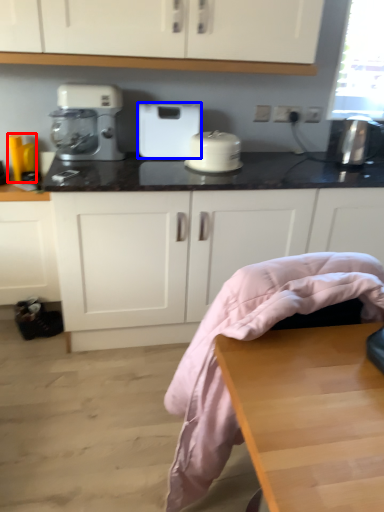
Question: Which object appears closest to the camera in this image, appliance (highlighted by a red box) or home appliance (highlighted by a blue box)?

Choices:
 (A) appliance
 (B) home appliance

Answer: (B)